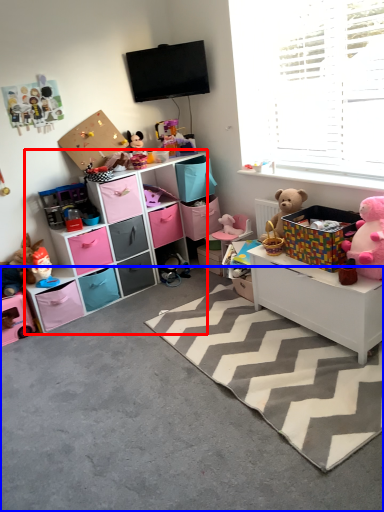
Question: Which point is further to the camera, shelf (highlighted by a red box) or concrete (highlighted by a blue box)?

Choices:
 (A) shelf
 (B) concrete

Answer: (A)